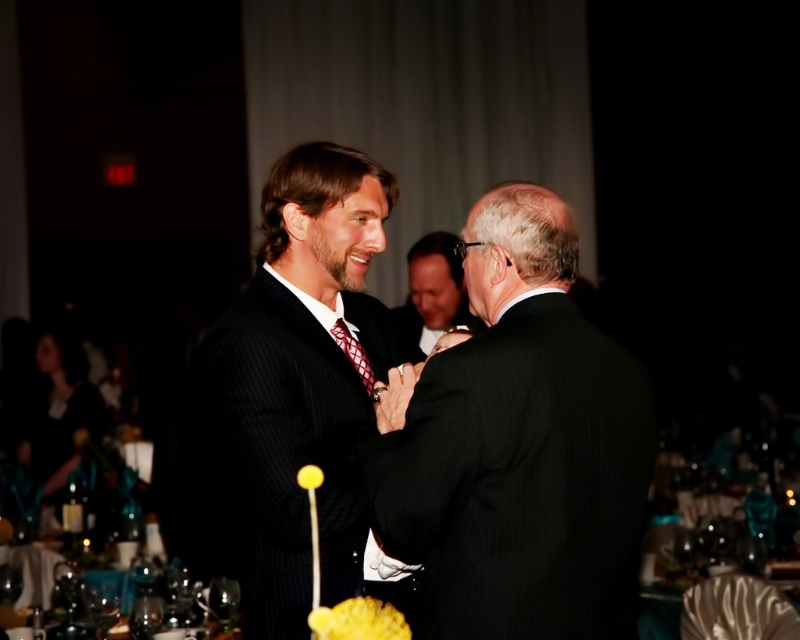
Question: Does smooth black suit at center appear on the left side of red textured tie at center?

Choices:
 (A) yes
 (B) no

Answer: (B)

Question: Is black pinstripe suit at center positioned behind silky black dress at lower left?

Choices:
 (A) yes
 (B) no

Answer: (B)

Question: Which of these objects is positioned closest to the black pinstripe suit at center?

Choices:
 (A) smooth black suit at center
 (B) pinstriped suit at center
 (C) silky black dress at lower left

Answer: (B)

Question: Estimate the real-world distances between objects in this image. Which object is closer to the red textured tie at center?

Choices:
 (A) pinstriped suit at center
 (B) black pinstripe suit at center

Answer: (A)

Question: Does pinstriped suit at center appear on the left side of silky black dress at lower left?

Choices:
 (A) yes
 (B) no

Answer: (B)

Question: Which object appears farthest from the camera in this image?

Choices:
 (A) pinstriped suit at center
 (B) smooth black suit at center

Answer: (B)